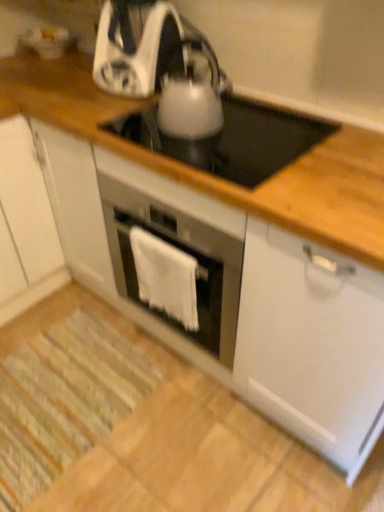
Where is `free point in front of satin silver kettle at center, arranged as the 1th kitchen appliance when viewed from the front`? free point in front of satin silver kettle at center, arranged as the 1th kitchen appliance when viewed from the front is located at coordinates (187, 151).